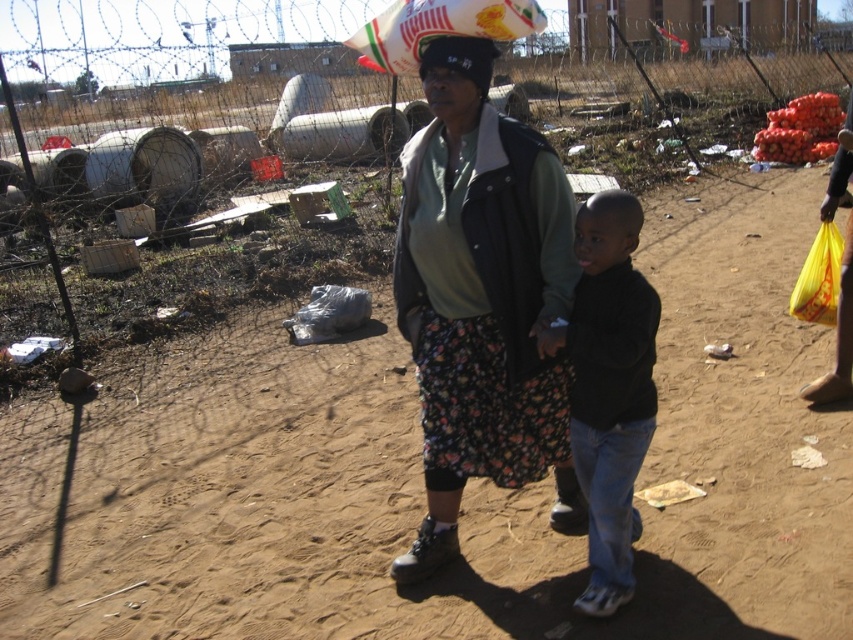
Question: Which point appears closest to the camera in this image?

Choices:
 (A) (480, 236)
 (B) (849, 227)
 (C) (444, 65)

Answer: (C)

Question: Does yellow plastic bag at right appear over matte black hat at center?

Choices:
 (A) no
 (B) yes

Answer: (A)

Question: Is floral fabric skirt at center smaller than matte black hat at center?

Choices:
 (A) yes
 (B) no

Answer: (B)

Question: Among these objects, which one is farthest from the camera?

Choices:
 (A) matte black hat at center
 (B) smooth black hair at center
 (C) black matte shirt at center

Answer: (A)

Question: Estimate the real-world distances between objects in this image. Which object is closer to the smooth black hair at center?

Choices:
 (A) floral fabric skirt at center
 (B) yellow plastic bag at right
 (C) matte black hat at center

Answer: (A)

Question: Can you confirm if floral fabric skirt at center is positioned above black matte shirt at center?

Choices:
 (A) no
 (B) yes

Answer: (B)